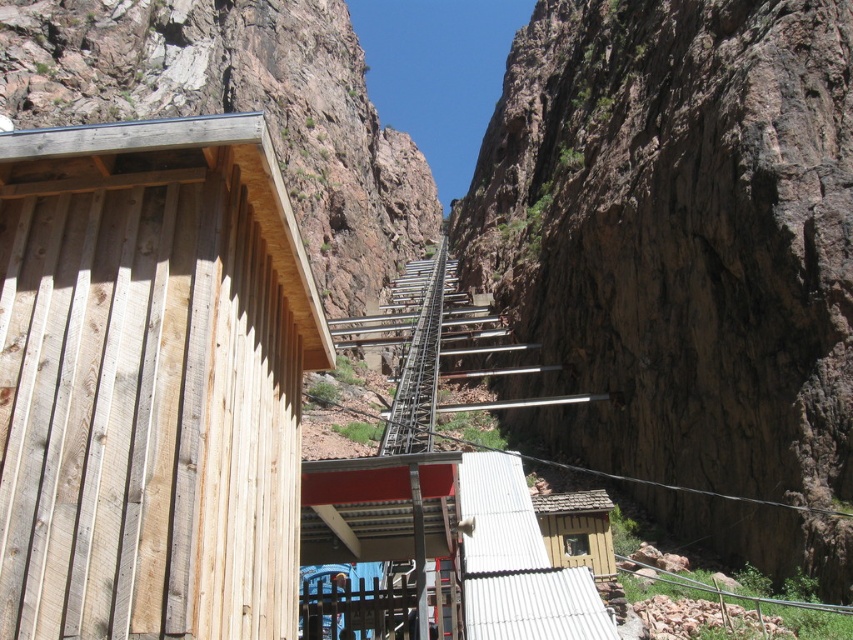
Question: Is the position of white corrugated metal hut at center less distant than that of metallic gray train track at center?

Choices:
 (A) no
 (B) yes

Answer: (B)

Question: Does metallic gray train track at center have a smaller size compared to wooden cabin at center-right?

Choices:
 (A) yes
 (B) no

Answer: (B)

Question: Considering the relative positions of brown rough rock at center and brown wood mountain at upper left in the image provided, where is brown rough rock at center located with respect to brown wood mountain at upper left?

Choices:
 (A) above
 (B) below

Answer: (B)

Question: Among these objects, which one is farthest from the camera?

Choices:
 (A) white corrugated metal hut at center
 (B) brown rough rock at center
 (C) wooden planks hut at left

Answer: (B)

Question: Among these points, which one is farthest from the camera?

Choices:
 (A) (247, 106)
 (B) (201, 509)
 (C) (566, 577)
 (D) (502, 124)

Answer: (D)

Question: Which object is the closest to the wooden planks hut at left?

Choices:
 (A) white corrugated metal hut at center
 (B) metallic gray train track at center
 (C) brown wood mountain at upper left
 (D) wooden cabin at center-right

Answer: (A)